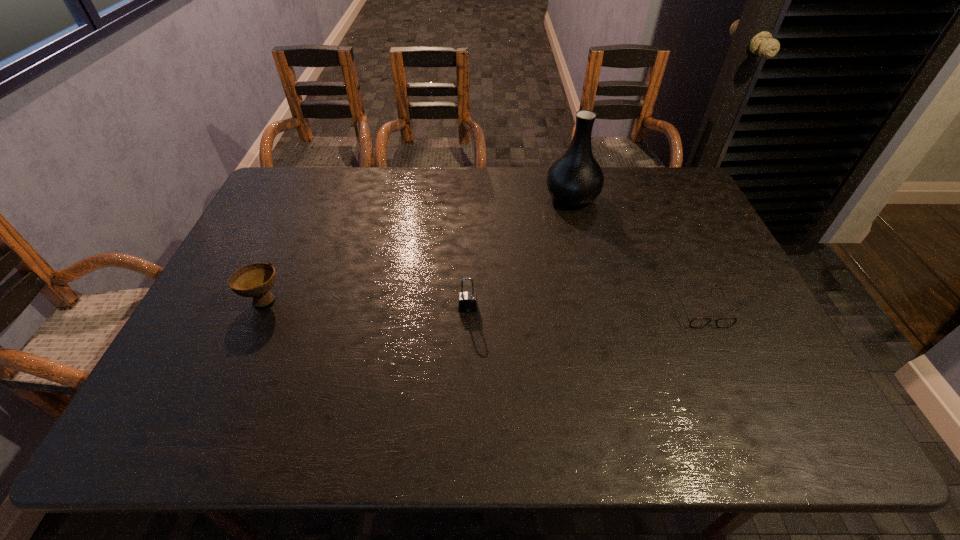
Find the location of a particular element. This screenshot has height=540, width=960. free space located on the front-facing side of the sunglasses is located at coordinates (746, 410).

Where is `object positioned at the far edge`? The image size is (960, 540). object positioned at the far edge is located at coordinates (575, 179).

At what (x,y) coordinates should I click in order to perform the action: click on object that is at the left edge. Please return your answer as a coordinate pair (x, y). The height and width of the screenshot is (540, 960). Looking at the image, I should click on (255, 280).

Locate an element on the screen. object located in the right edge section of the desktop is located at coordinates (695, 322).

Locate an element on the screen. free region at the far edge of the desktop is located at coordinates (360, 207).

The height and width of the screenshot is (540, 960). In the image, there is a desktop. Identify the location of vacant space at the near edge. (417, 409).

You are a GUI agent. You are given a task and a screenshot of the screen. Output one action in this format:
    pyautogui.click(x=<x>, y=<y>)
    Task: Click on the vacant space at the left edge of the desktop
    Image resolution: width=960 pixels, height=540 pixels.
    Given the screenshot: What is the action you would take?
    (229, 345)

Identify the location of vacant space at the right edge of the desktop. (713, 233).

The image size is (960, 540). What are the coordinates of `vacant space at the far left corner` in the screenshot? It's located at (277, 191).

Where is `vacant position at the far right corner of the desktop`? The image size is (960, 540). vacant position at the far right corner of the desktop is located at coordinates (679, 170).